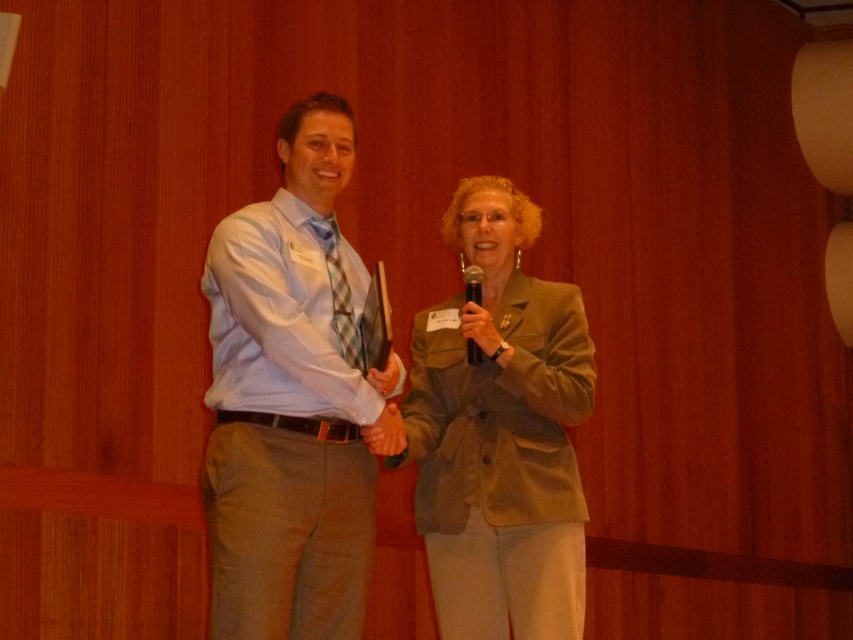
You are standing in the room and want to hand a document to the person wearing the light blue shirt at center. Where should you walk to in order to reach them?

The light blue shirt at center is located at point 0.625 on the x axis and 0.343 on the y axis, so you should walk towards the coordinates of (292, 400) to reach them.

You are a photographer at the event and need to capture a closeup of the matte green blazer at center and the black plastic microphone at center. Which object should you zoom in more on to ensure both are clearly visible in the photo?

Since the matte green blazer at center is larger than the black plastic microphone at center, you should zoom in more on the matte green blazer at center to ensure both objects are clearly visible in the photo.